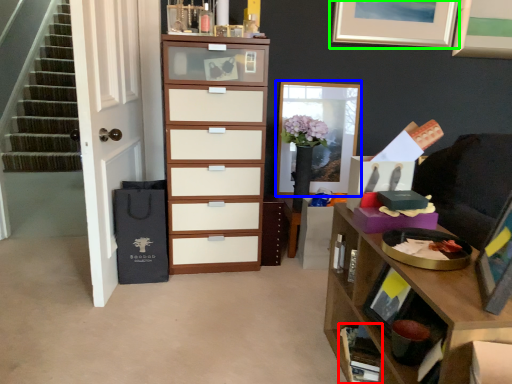
Question: Which is farther away from cabinet (highlighted by a red box)? picture frame (highlighted by a blue box) or picture frame (highlighted by a green box)?

Choices:
 (A) picture frame
 (B) picture frame

Answer: (B)